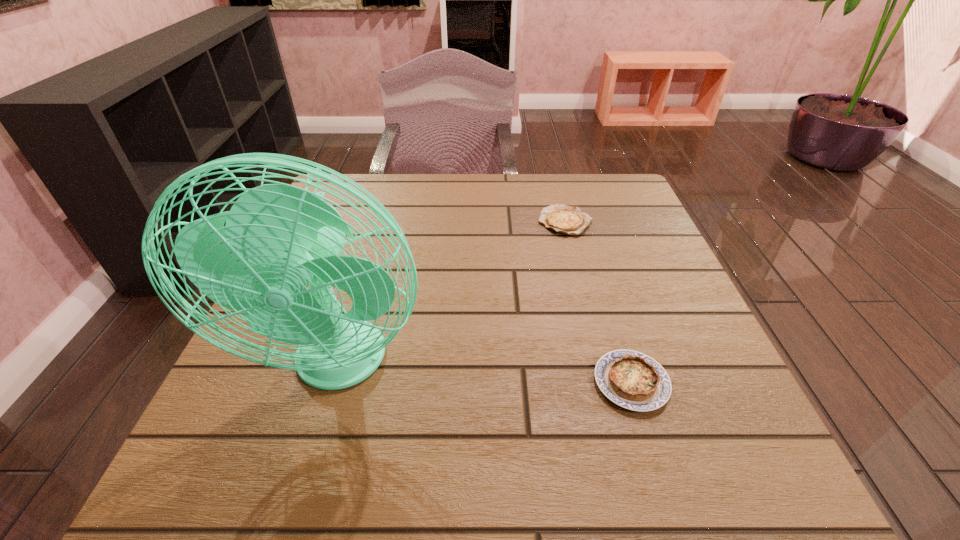
This screenshot has width=960, height=540. I want to click on the second closest object relative to the shortest object, so click(x=279, y=239).

Where is `free space that satisfies the following two spatial constraints: 1. in front of the fan to blow air; 2. on the right side of the second shortest object`? free space that satisfies the following two spatial constraints: 1. in front of the fan to blow air; 2. on the right side of the second shortest object is located at coordinates (334, 382).

Where is `vacant space that satisfies the following two spatial constraints: 1. in front of the tallest object to blow air; 2. on the right side of the second shortest object`? vacant space that satisfies the following two spatial constraints: 1. in front of the tallest object to blow air; 2. on the right side of the second shortest object is located at coordinates (334, 382).

Where is `vacant space that satisfies the following two spatial constraints: 1. in front of the nearer quiche to blow air; 2. on the right side of the fan`? This screenshot has height=540, width=960. vacant space that satisfies the following two spatial constraints: 1. in front of the nearer quiche to blow air; 2. on the right side of the fan is located at coordinates (334, 382).

Locate an element on the screen. free space in the image that satisfies the following two spatial constraints: 1. in front of the second tallest object to blow air; 2. on the left side of the tallest object is located at coordinates [334, 382].